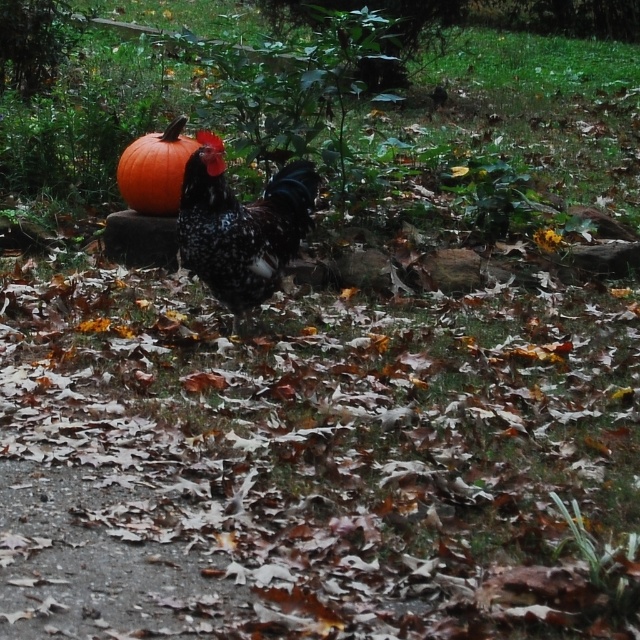
You are a farmer checking the distance between the speckled feathered rooster at center and the orange matte pumpkin at upper left. Your tractor has a 30 inch wide plow. Can you safely plow a straight path between them without hitting either?

The distance between the speckled feathered rooster at center and the orange matte pumpkin at upper left is 27.21 inches. Since the plow is 30 inches wide, it is wider than the space between them. Therefore, you cannot safely plow a straight path between them without risking collision with either object.

You are a farmer checking the size of your animals and crops. You have a storage bin that can hold items up to 1 meter wide. You see the speckled feathered rooster at center and the orange matte pumpkin at upper left. Which one will not fit in the bin if their widths are as described?

The speckled feathered rooster at center has a larger width than the orange matte pumpkin at upper left, so the speckled feathered rooster at center will not fit in the storage bin.